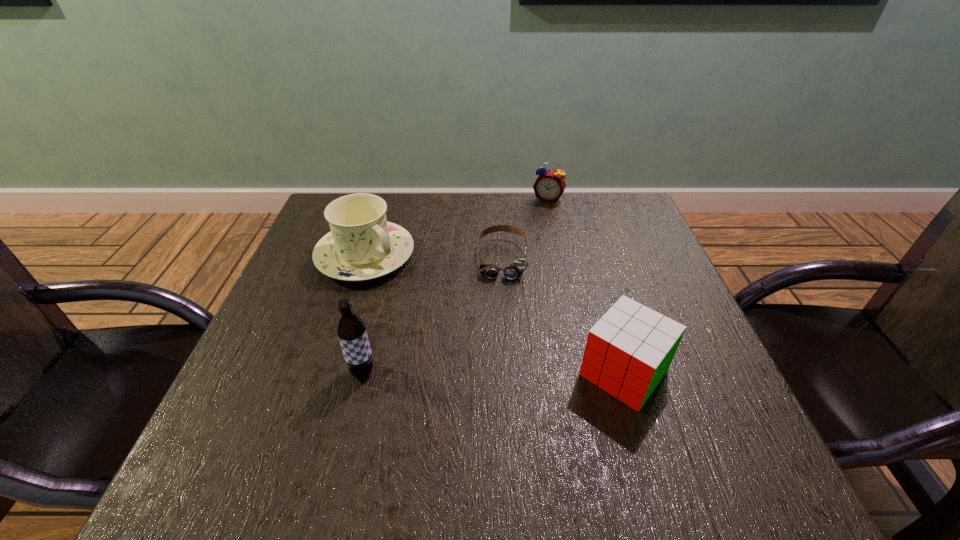
Identify the location of root beer. 351,330.

This screenshot has width=960, height=540. I want to click on cube, so click(628, 351).

Where is `the third object from left to right`? The height and width of the screenshot is (540, 960). the third object from left to right is located at coordinates (515, 269).

The width and height of the screenshot is (960, 540). I want to click on goggles, so click(x=515, y=269).

Image resolution: width=960 pixels, height=540 pixels. I want to click on the farthest object, so click(549, 186).

Where is `chinaware`? This screenshot has width=960, height=540. chinaware is located at coordinates (362, 245).

At what (x,y) coordinates should I click in order to perform the action: click on vacant space located on the back of the root beer. Please return your answer as a coordinate pair (x, y). This screenshot has width=960, height=540. Looking at the image, I should click on (379, 303).

This screenshot has height=540, width=960. In order to click on vacant space situated on the left of the cube in this screenshot , I will do (x=407, y=373).

You are a GUI agent. You are given a task and a screenshot of the screen. Output one action in this format:
    pyautogui.click(x=<x>, y=<y>)
    Task: Click on the vacant space located on the front-facing side of the shortest object
    The width and height of the screenshot is (960, 540).
    Given the screenshot: What is the action you would take?
    pyautogui.click(x=501, y=305)

You are a GUI agent. You are given a task and a screenshot of the screen. Output one action in this format:
    pyautogui.click(x=<x>, y=<y>)
    Task: Click on the vacant space located on the front-facing side of the shortest object
    Image resolution: width=960 pixels, height=540 pixels.
    Given the screenshot: What is the action you would take?
    pyautogui.click(x=496, y=431)